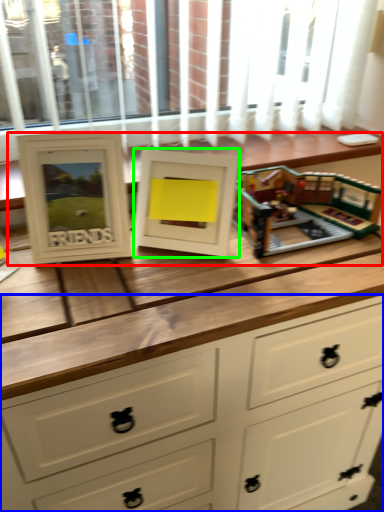
Question: Which is farther away from buffet (highlighted by a red box)? chest of drawers (highlighted by a blue box) or picture frame (highlighted by a green box)?

Choices:
 (A) chest of drawers
 (B) picture frame

Answer: (A)